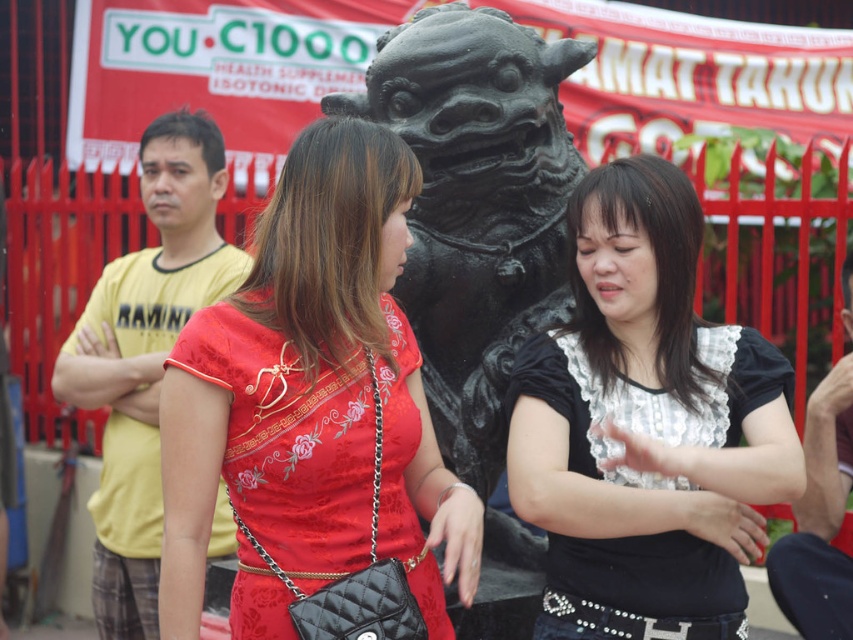
Question: In this image, where is matte red dress at center located relative to black lace blouse at center?

Choices:
 (A) left
 (B) right

Answer: (A)

Question: Which point appears closest to the camera in this image?

Choices:
 (A) (422, 225)
 (B) (395, 246)

Answer: (B)

Question: Among these objects, which one is farthest from the camera?

Choices:
 (A) black lace blouse at center
 (B) matte red dress at center
 (C) black stone statue at center

Answer: (C)

Question: Estimate the real-world distances between objects in this image. Which object is closer to the matte red dress at center?

Choices:
 (A) black lace blouse at center
 (B) black stone statue at center

Answer: (B)

Question: Is black lace blouse at center below black stone statue at center?

Choices:
 (A) yes
 (B) no

Answer: (A)

Question: In this image, where is matte red dress at center located relative to black lace blouse at center?

Choices:
 (A) above
 (B) below

Answer: (A)